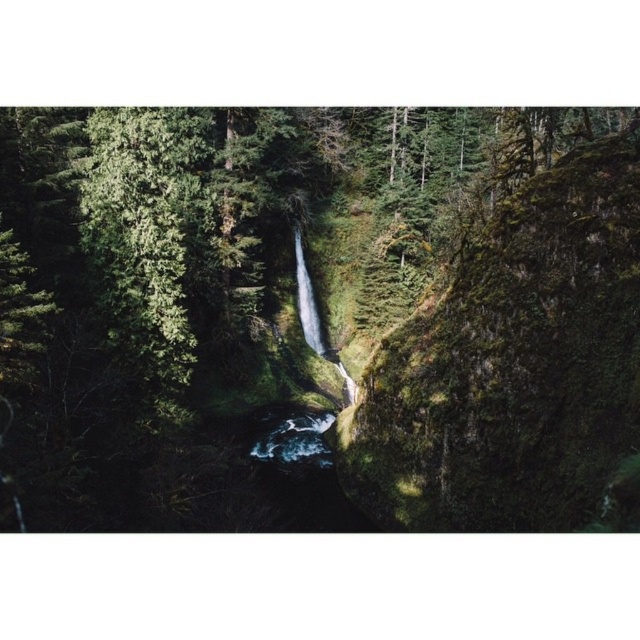
Question: Which point is closer to the camera?

Choices:
 (A) (150, 164)
 (B) (316, 348)

Answer: (A)

Question: Which object appears closest to the camera in this image?

Choices:
 (A) clear water at center
 (B) green mossy rock at center

Answer: (B)

Question: Can you confirm if green mossy rock at center is bigger than clear water at center?

Choices:
 (A) no
 (B) yes

Answer: (B)

Question: Is green mossy rock at center below clear water at center?

Choices:
 (A) yes
 (B) no

Answer: (B)

Question: Is green mossy rock at center below clear water at center?

Choices:
 (A) no
 (B) yes

Answer: (A)

Question: Which of the following is the farthest from the observer?

Choices:
 (A) green mossy rock at center
 (B) clear water at center

Answer: (B)